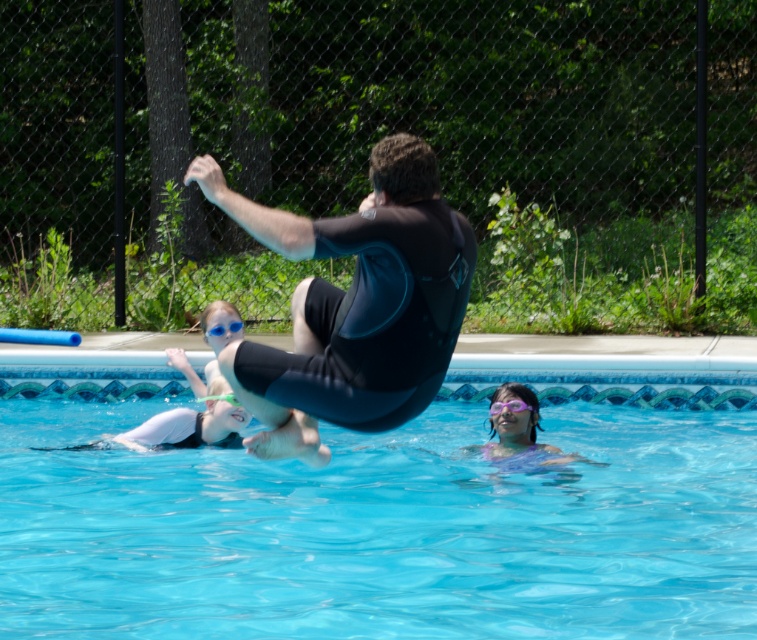
How far apart are transparent blue water at center and blue plastic goggles at center?

The distance of transparent blue water at center from blue plastic goggles at center is 4.75 meters.

Looking at this image, does transparent blue water at center have a lesser height compared to blue plastic goggles at center?

Correct, transparent blue water at center is not as tall as blue plastic goggles at center.

Which is behind, point (497, 536) or point (215, 333)?

The point (215, 333) is more distant.

The image size is (757, 640). Identify the location of transparent blue water at center. pos(388,515).

Between transparent blue water at center and purple matte goggles at lower center, which one has less height?

transparent blue water at center

Is transparent blue water at center positioned in front of purple matte goggles at lower center?

Yes, it is in front of purple matte goggles at lower center.

Is point (749, 356) closer to camera compared to point (511, 400)?

No, (749, 356) is behind (511, 400).

In order to click on transparent blue water at center in this screenshot , I will do `click(388, 515)`.

Which is more to the right, blue plastic goggles at center or purple matte goggles at lower center?

From the viewer's perspective, purple matte goggles at lower center appears more on the right side.

Between point (234, 332) and point (531, 412), which one is positioned in front?

Point (531, 412)

Where is `blue plastic goggles at center`? blue plastic goggles at center is located at coordinates (223, 326).